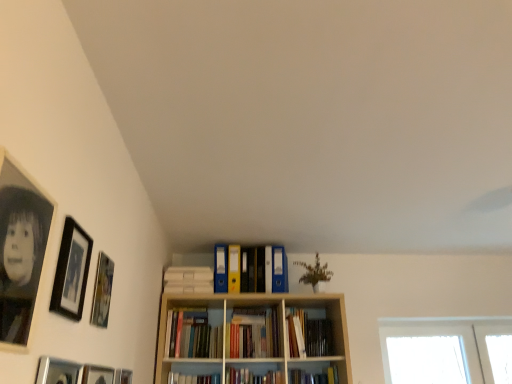
The width and height of the screenshot is (512, 384). Describe the element at coordinates (314, 376) in the screenshot. I see `hardcover book at center, the third book from the top` at that location.

What do you see at coordinates (97, 374) in the screenshot? I see `matte black picture frame at lower left, the 3th picture frame positioned from the back` at bounding box center [97, 374].

Find the location of a particular element. black matte picture frame at left, acting as the 1th picture frame starting from the front is located at coordinates click(20, 250).

Describe the element at coordinates (71, 271) in the screenshot. The image size is (512, 384). I see `black matte picture frame at upper left, the 3th picture frame when ordered from front to back` at that location.

This screenshot has width=512, height=384. I want to click on green matte plant at upper center, so click(x=315, y=274).

Describe the element at coordinates (123, 376) in the screenshot. The width and height of the screenshot is (512, 384). I see `matte black picture frame at lower left, the sixth picture frame viewed from the front` at that location.

Identify the location of matte plastic folders at center, the 3th book in the bottom-to-top sequence. This screenshot has width=512, height=384. (260, 270).

Identify the location of hardcover book at center, the third book from the top. (314, 376).

Does matte wooden picture frame at left, which ranks as the 5th picture frame in front-to-back order, turn towards green matte plant at upper center?

No, matte wooden picture frame at left, which ranks as the 5th picture frame in front-to-back order, is not aimed at green matte plant at upper center.

Is matte wooden picture frame at left, which ranks as the 5th picture frame in front-to-back order, at the left side of green matte plant at upper center?

Yes.

From a real-world perspective, which is physically above, matte wooden picture frame at left, which ranks as the 2th picture frame in back-to-front order, or green matte plant at upper center?

green matte plant at upper center is physically above.

From the picture: Which is closer, (78, 287) or (293, 383)?

Point (78, 287)

Does black matte picture frame at upper left, the 3th picture frame when ordered from front to back, have a greater width compared to hardcover book at center, the third book from the top?

No.

What's the angular difference between black matte picture frame at upper left, placed as the 4th picture frame when sorted from back to front, and hardcover book at center, the 1th book ordered from the bottom,'s facing directions?

88.9 degrees.

Consider the image. From the image's perspective, which is below, black matte picture frame at upper left, placed as the 4th picture frame when sorted from back to front, or hardcover book at center, the 1th book ordered from the bottom?

hardcover book at center, the 1th book ordered from the bottom, is shown below in the image.

Is hardcover books at center, the 2th book when ordered from bottom to top, not near green matte plant at upper center?

No, hardcover books at center, the 2th book when ordered from bottom to top, is not far from green matte plant at upper center.

Which is behind, hardcover books at center, placed as the 2th book when sorted from top to bottom, or green matte plant at upper center?

Result: green matte plant at upper center is more distant.

From the image's perspective, does hardcover books at center, placed as the 2th book when sorted from top to bottom, appear higher than green matte plant at upper center?

No.

Considering the sizes of metallic silver picture frame at lower left, the fifth picture frame in the back-to-front sequence, and matte plastic folders at center, the 3th book in the bottom-to-top sequence, in the image, is metallic silver picture frame at lower left, the fifth picture frame in the back-to-front sequence, taller or shorter than matte plastic folders at center, the 3th book in the bottom-to-top sequence,?

Clearly, metallic silver picture frame at lower left, the fifth picture frame in the back-to-front sequence, is taller compared to matte plastic folders at center, the 3th book in the bottom-to-top sequence.

Which is less distant, (57, 366) or (230, 267)?

Point (57, 366) appears to be closer to the viewer than point (230, 267).

Would you say metallic silver picture frame at lower left, arranged as the 2th picture frame when viewed from the front, is outside matte plastic folders at center, the 3th book in the bottom-to-top sequence?

Yes, metallic silver picture frame at lower left, arranged as the 2th picture frame when viewed from the front, is located beyond the bounds of matte plastic folders at center, the 3th book in the bottom-to-top sequence.

Does hardcover books at center, the 2th book when ordered from bottom to top, turn towards matte black picture frame at lower left, which is the first picture frame in back-to-front order?

No, hardcover books at center, the 2th book when ordered from bottom to top, is not turned towards matte black picture frame at lower left, which is the first picture frame in back-to-front order.

Looking at the image, does hardcover books at center, placed as the 2th book when sorted from top to bottom, seem bigger or smaller compared to matte black picture frame at lower left, the sixth picture frame viewed from the front?

Clearly, hardcover books at center, placed as the 2th book when sorted from top to bottom, is larger in size than matte black picture frame at lower left, the sixth picture frame viewed from the front.

From a real-world perspective, between hardcover books at center, the 2th book when ordered from bottom to top, and matte black picture frame at lower left, which is the first picture frame in back-to-front order, who is vertically higher?

In real-world perspective, hardcover books at center, the 2th book when ordered from bottom to top, is above.

From the picture: Between hardcover books at center, the 2th book when ordered from bottom to top, and matte black picture frame at lower left, which is the first picture frame in back-to-front order, which one has less height?

Standing shorter between the two is matte black picture frame at lower left, which is the first picture frame in back-to-front order.

From the image's perspective, is green matte plant at upper center located above or below black matte picture frame at left, marked as the sixth picture frame in a back-to-front arrangement?

Clearly, from the image's perspective, green matte plant at upper center is below black matte picture frame at left, marked as the sixth picture frame in a back-to-front arrangement.

Identify the location of plant above the black matte picture frame at left, marked as the sixth picture frame in a back-to-front arrangement (from a real-world perspective). (315, 274).

From the picture: Can you confirm if green matte plant at upper center is smaller than black matte picture frame at left, acting as the 1th picture frame starting from the front?

Incorrect, green matte plant at upper center is not smaller in size than black matte picture frame at left, acting as the 1th picture frame starting from the front.

Is green matte plant at upper center taller than black matte picture frame at left, marked as the sixth picture frame in a back-to-front arrangement?

No, green matte plant at upper center is not taller than black matte picture frame at left, marked as the sixth picture frame in a back-to-front arrangement.

Locate an element on the screen. The image size is (512, 384). the 2nd book behind the metallic silver picture frame at lower left, the fifth picture frame in the back-to-front sequence is located at coordinates (314, 376).

Is hardcover book at center, the third book from the top, not close to metallic silver picture frame at lower left, the fifth picture frame in the back-to-front sequence?

That's right, there is a large distance between hardcover book at center, the third book from the top, and metallic silver picture frame at lower left, the fifth picture frame in the back-to-front sequence.

Considering the positions of point (322, 378) and point (72, 370), is point (322, 378) closer or farther from the camera than point (72, 370)?

Clearly, point (322, 378) is more distant from the camera than point (72, 370).

You are a GUI agent. You are given a task and a screenshot of the screen. Output one action in this format:
    pyautogui.click(x=<x>, y=<y>)
    Task: Click on the 1st picture frame above when counting from the green matte plant at upper center (from the image's perspective)
    
    Given the screenshot: What is the action you would take?
    pyautogui.click(x=102, y=291)

This screenshot has width=512, height=384. Identify the location of the 3rd picture frame counting from the left of the hardcover book at center, the 1th book ordered from the bottom. (71, 271).

Estimate the real-world distances between objects in this image. Which object is closer to hardcover books at center, placed as the 2th book when sorted from top to bottom, matte plastic folders at center, the 3th book in the bottom-to-top sequence, or matte black picture frame at lower left, the sixth picture frame viewed from the front?

matte plastic folders at center, the 3th book in the bottom-to-top sequence, is closer to hardcover books at center, placed as the 2th book when sorted from top to bottom.

Consider the image. Estimate the real-world distances between objects in this image. Which object is further from matte wooden picture frame at left, which ranks as the 5th picture frame in front-to-back order, matte black picture frame at lower left, the 3th picture frame positioned from the back, or black matte picture frame at left, marked as the sixth picture frame in a back-to-front arrangement?

Among the two, black matte picture frame at left, marked as the sixth picture frame in a back-to-front arrangement, is located further to matte wooden picture frame at left, which ranks as the 5th picture frame in front-to-back order.

Based on their spatial positions, is metallic silver picture frame at lower left, the fifth picture frame in the back-to-front sequence, or hardcover books at center, the 2th book when ordered from bottom to top, closer to green matte plant at upper center?

hardcover books at center, the 2th book when ordered from bottom to top, is closer to green matte plant at upper center.

From the image, which object appears to be farther from hardcover books at center, placed as the 2th book when sorted from top to bottom, black matte picture frame at left, acting as the 1th picture frame starting from the front, or matte black picture frame at lower left, the fourth picture frame when ordered from front to back?

The object further to hardcover books at center, placed as the 2th book when sorted from top to bottom, is black matte picture frame at left, acting as the 1th picture frame starting from the front.

Looking at the image, which one is located further to metallic silver picture frame at lower left, the fifth picture frame in the back-to-front sequence, matte plastic folders at center, the 3th book in the bottom-to-top sequence, or matte black picture frame at lower left, the fourth picture frame when ordered from front to back?

Among the two, matte plastic folders at center, the 3th book in the bottom-to-top sequence, is located further to metallic silver picture frame at lower left, the fifth picture frame in the back-to-front sequence.

When comparing their distances from matte plastic folders at center, the first book in the top-to-bottom sequence, does black matte picture frame at left, marked as the sixth picture frame in a back-to-front arrangement, or matte wooden picture frame at left, which ranks as the 5th picture frame in front-to-back order, seem closer?

Based on the image, matte wooden picture frame at left, which ranks as the 5th picture frame in front-to-back order, appears to be nearer to matte plastic folders at center, the first book in the top-to-bottom sequence.

Looking at the image, which one is located closer to matte wooden picture frame at left, which ranks as the 5th picture frame in front-to-back order, black matte picture frame at left, marked as the sixth picture frame in a back-to-front arrangement, or green matte plant at upper center?

The object closer to matte wooden picture frame at left, which ranks as the 5th picture frame in front-to-back order, is black matte picture frame at left, marked as the sixth picture frame in a back-to-front arrangement.

When comparing their distances from green matte plant at upper center, does matte black picture frame at lower left, the 3th picture frame positioned from the back, or matte black picture frame at lower left, which is the first picture frame in back-to-front order, seem further?

Based on the image, matte black picture frame at lower left, the 3th picture frame positioned from the back, appears to be further to green matte plant at upper center.

Where is `plant located between matte black picture frame at lower left, the fourth picture frame when ordered from front to back, and hardcover book at center, the 1th book ordered from the bottom, in the depth direction`? The image size is (512, 384). plant located between matte black picture frame at lower left, the fourth picture frame when ordered from front to back, and hardcover book at center, the 1th book ordered from the bottom, in the depth direction is located at coordinates (315, 274).

Find the location of a particular element. book located between matte black picture frame at lower left, the sixth picture frame viewed from the front, and hardcover book at center, the third book from the top, in the depth direction is located at coordinates (309, 335).

At what (x,y) coordinates should I click in order to perform the action: click on book between black matte picture frame at upper left, the 3th picture frame when ordered from front to back, and hardcover book at center, the 1th book ordered from the bottom, along the z-axis. Please return your answer as a coordinate pair (x, y). Looking at the image, I should click on (309, 335).

The image size is (512, 384). I want to click on plant between metallic silver picture frame at lower left, the fifth picture frame in the back-to-front sequence, and matte plastic folders at center, the 3th book in the bottom-to-top sequence, along the z-axis, so click(315, 274).